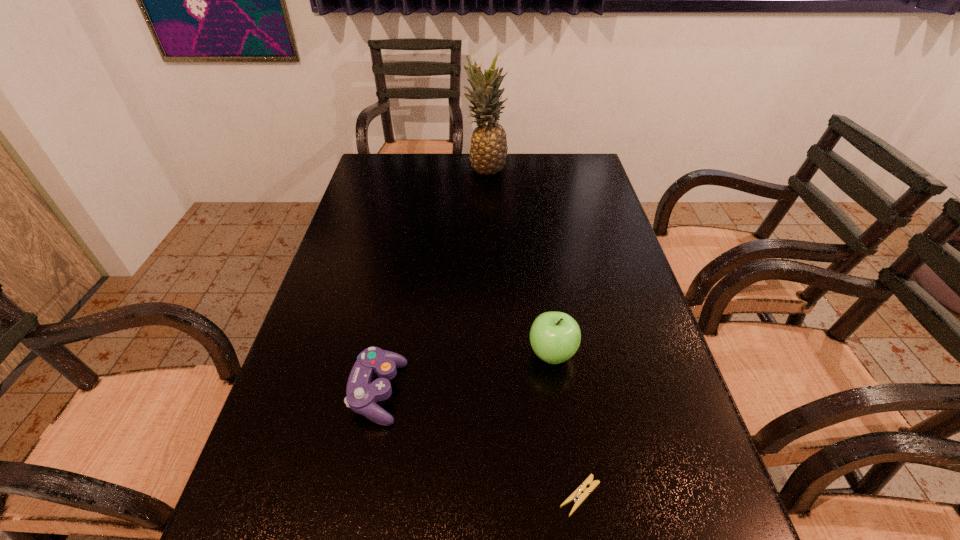
Locate an element on the screen. This screenshot has width=960, height=540. the third object from right to left is located at coordinates (488, 151).

This screenshot has width=960, height=540. In order to click on the tallest object in this screenshot , I will do `click(488, 151)`.

This screenshot has height=540, width=960. I want to click on apple, so click(555, 337).

Identify the location of the second shortest object. The width and height of the screenshot is (960, 540). (363, 392).

The image size is (960, 540). I want to click on the leftmost object, so click(x=363, y=392).

At what (x,y) coordinates should I click in order to perform the action: click on clothespin. Please return your answer as a coordinate pair (x, y). This screenshot has width=960, height=540. Looking at the image, I should click on (580, 497).

Identify the location of the shortest object. This screenshot has height=540, width=960. (580, 497).

Where is `vacant region located 0.310m on the left of the pineapple`? The width and height of the screenshot is (960, 540). vacant region located 0.310m on the left of the pineapple is located at coordinates (381, 168).

The width and height of the screenshot is (960, 540). What are the coordinates of `free space located on the back of the apple` in the screenshot? It's located at (541, 279).

At what (x,y) coordinates should I click in order to perform the action: click on vacant region located on the front of the second shortest object. Please return your answer as a coordinate pair (x, y). The image size is (960, 540). Looking at the image, I should click on (360, 485).